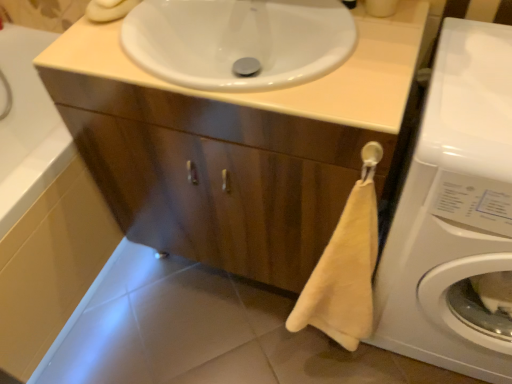
In order to face wooden cabinet at center, should I rotate leftwards or rightwards?

It's best to rotate left around 1.034 degrees.

What do you see at coordinates (284, 88) in the screenshot?
I see `white glossy sink at upper center` at bounding box center [284, 88].

Consider the image. In order to face white glossy sink at upper center, should I rotate leftwards or rightwards?

It's best to rotate left around 2.143 degrees.

Identify the location of wooden cabinet at center. The height and width of the screenshot is (384, 512). (234, 146).

Considering the sizes of objects white glossy bath at lower left and white glossy tile at lower center in the image provided, who is taller, white glossy bath at lower left or white glossy tile at lower center?

Standing taller between the two is white glossy bath at lower left.

Between white glossy bath at lower left and white glossy tile at lower center, which one has larger size?

With larger size is white glossy bath at lower left.

Which is in front, point (82, 288) or point (201, 383)?

The point (201, 383) is more forward.

How many degrees apart are the facing directions of white glossy tile at lower center and white glossy sink at upper center?

The angle between the facing direction of white glossy tile at lower center and the facing direction of white glossy sink at upper center is 5.05 degrees.

Does white glossy tile at lower center have a lesser height compared to white glossy sink at upper center?

Correct, white glossy tile at lower center is not as tall as white glossy sink at upper center.

Considering the positions of objects white glossy tile at lower center and white glossy sink at upper center in the image provided, who is in front, white glossy tile at lower center or white glossy sink at upper center?

white glossy sink at upper center is in front.

Can you tell me how much white glossy tile at lower center and white glossy washing machine at lower right differ in facing direction?

There is a 5.05-degree angle between the facing directions of white glossy tile at lower center and white glossy washing machine at lower right.

Is white glossy tile at lower center to the left of white glossy washing machine at lower right from the viewer's perspective?

Yes.

Is white glossy washing machine at lower right surrounded by white glossy tile at lower center?

That's incorrect, white glossy washing machine at lower right is not inside white glossy tile at lower center.

Which of these two, white glossy tile at lower center or white glossy washing machine at lower right, is wider?

white glossy washing machine at lower right is wider.

Looking at this image, is white glossy sink at upper center thinner than white glossy washing machine at lower right?

In fact, white glossy sink at upper center might be wider than white glossy washing machine at lower right.

Which object is positioned more to the left, white glossy sink at upper center or white glossy washing machine at lower right?

Positioned to the left is white glossy sink at upper center.

From a real-world perspective, who is located lower, white glossy sink at upper center or white glossy washing machine at lower right?

white glossy washing machine at lower right.

From the image's perspective, is white glossy sink at upper center above or below white glossy washing machine at lower right?

Clearly, from the image's perspective, white glossy sink at upper center is above white glossy washing machine at lower right.

Considering the sizes of white glossy bath at lower left and white glossy sink at upper center in the image, is white glossy bath at lower left taller or shorter than white glossy sink at upper center?

Considering their sizes, white glossy bath at lower left has more height than white glossy sink at upper center.

Does white glossy bath at lower left turn towards white glossy sink at upper center?

No, white glossy bath at lower left is not aimed at white glossy sink at upper center.

Considering the relative sizes of white glossy bath at lower left and white glossy sink at upper center in the image provided, is white glossy bath at lower left bigger than white glossy sink at upper center?

Yes, white glossy bath at lower left is bigger than white glossy sink at upper center.

Is white glossy bath at lower left not near white glossy sink at upper center?

Actually, white glossy bath at lower left and white glossy sink at upper center are a little close together.

Between wooden cabinet at center and white glossy bath at lower left, which one appears on the left side from the viewer's perspective?

white glossy bath at lower left is more to the left.

Measure the distance between wooden cabinet at center and white glossy bath at lower left.

wooden cabinet at center is 14.03 inches away from white glossy bath at lower left.

From the image's perspective, is wooden cabinet at center on top of white glossy bath at lower left?

Indeed, from the image's perspective, wooden cabinet at center is shown above white glossy bath at lower left.

In the scene shown: Is wooden cabinet at center smaller than white glossy bath at lower left?

Yes, wooden cabinet at center is smaller than white glossy bath at lower left.

In the scene shown: How much distance is there between wooden cabinet at center and white glossy tile at lower center?

wooden cabinet at center and white glossy tile at lower center are 23.61 inches apart.

Is wooden cabinet at center not within white glossy tile at lower center?

wooden cabinet at center is positioned outside white glossy tile at lower center.

Between wooden cabinet at center and white glossy tile at lower center, which one has larger width?

wooden cabinet at center is wider.

Consider the image. Who is smaller, wooden cabinet at center or white glossy tile at lower center?

white glossy tile at lower center.

Identify the location of tile behind the white glossy bath at lower left. The height and width of the screenshot is (384, 512). (232, 368).

Locate an element on the screen. tile below the white glossy sink at upper center (from a real-world perspective) is located at coordinates (232, 368).

From the image, which object appears to be nearer to white glossy sink at upper center, white glossy bath at lower left or white glossy washing machine at lower right?

white glossy washing machine at lower right lies closer to white glossy sink at upper center than the other object.

Which object lies nearer to the anchor point white glossy washing machine at lower right, white glossy sink at upper center or white glossy bath at lower left?

Among the two, white glossy sink at upper center is located nearer to white glossy washing machine at lower right.

Looking at the image, which one is located further to wooden cabinet at center, white glossy tile at lower center or white glossy sink at upper center?

Among the two, white glossy tile at lower center is located further to wooden cabinet at center.

When comparing their distances from white glossy tile at lower center, does white glossy washing machine at lower right or white glossy bath at lower left seem closer?

The object closer to white glossy tile at lower center is white glossy bath at lower left.

Considering their positions, is wooden cabinet at center positioned closer to white glossy tile at lower center than white glossy sink at upper center?

wooden cabinet at center is positioned closer to the anchor white glossy tile at lower center.

When comparing their distances from wooden cabinet at center, does white glossy washing machine at lower right or white glossy bath at lower left seem further?

Among the two, white glossy bath at lower left is located further to wooden cabinet at center.

Looking at the image, which one is located further to white glossy tile at lower center, white glossy bath at lower left or white glossy washing machine at lower right?

white glossy washing machine at lower right is positioned further to the anchor white glossy tile at lower center.

Which object lies further to the anchor point white glossy bath at lower left, white glossy sink at upper center or white glossy washing machine at lower right?

Among the two, white glossy washing machine at lower right is located further to white glossy bath at lower left.

I want to click on bathroom cabinet located between white glossy bath at lower left and white glossy washing machine at lower right in the left-right direction, so (234, 146).

Find the location of a particular element. The width and height of the screenshot is (512, 384). washing machine between white glossy sink at upper center and white glossy tile at lower center in the up-down direction is located at coordinates (454, 214).

Find the location of a particular element. This screenshot has height=384, width=512. washing machine between wooden cabinet at center and white glossy tile at lower center in the up-down direction is located at coordinates (454, 214).

The width and height of the screenshot is (512, 384). Identify the location of tile situated between white glossy bath at lower left and wooden cabinet at center from left to right. (232, 368).